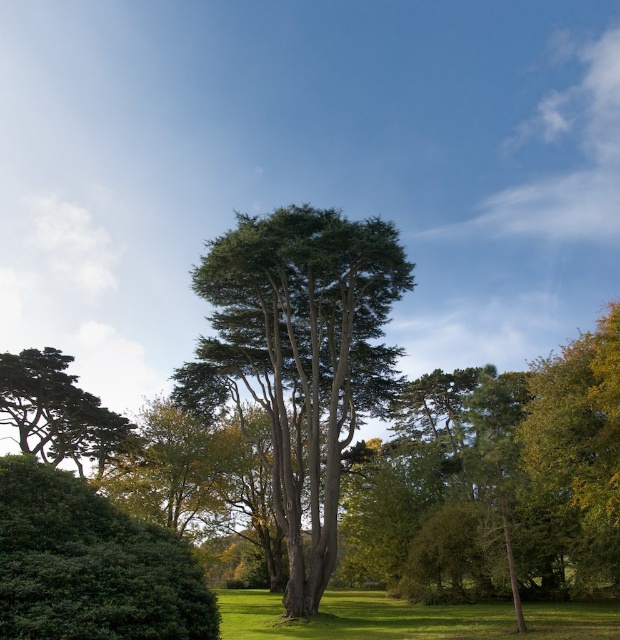
Question: From the image, what is the correct spatial relationship of green leafy hedge at lower left in relation to green textured tree at lower left?

Choices:
 (A) right
 (B) left

Answer: (A)

Question: Which of the following is the closest to the observer?

Choices:
 (A) green leafy hedge at lower left
 (B) green leafy tree at center

Answer: (A)

Question: Which is farther from the green grassy field at lower center?

Choices:
 (A) green leafy tree at center
 (B) green leafy hedge at lower left

Answer: (B)

Question: Does green leafy tree at center have a greater width compared to green leafy hedge at lower left?

Choices:
 (A) no
 (B) yes

Answer: (B)

Question: Among these points, which one is farthest from the camera?

Choices:
 (A) (345, 589)
 (B) (100, 621)
 (C) (81, 444)
 (D) (314, 376)

Answer: (A)

Question: Considering the relative positions of green grassy field at lower center and green textured tree at lower left in the image provided, where is green grassy field at lower center located with respect to green textured tree at lower left?

Choices:
 (A) below
 (B) above

Answer: (A)